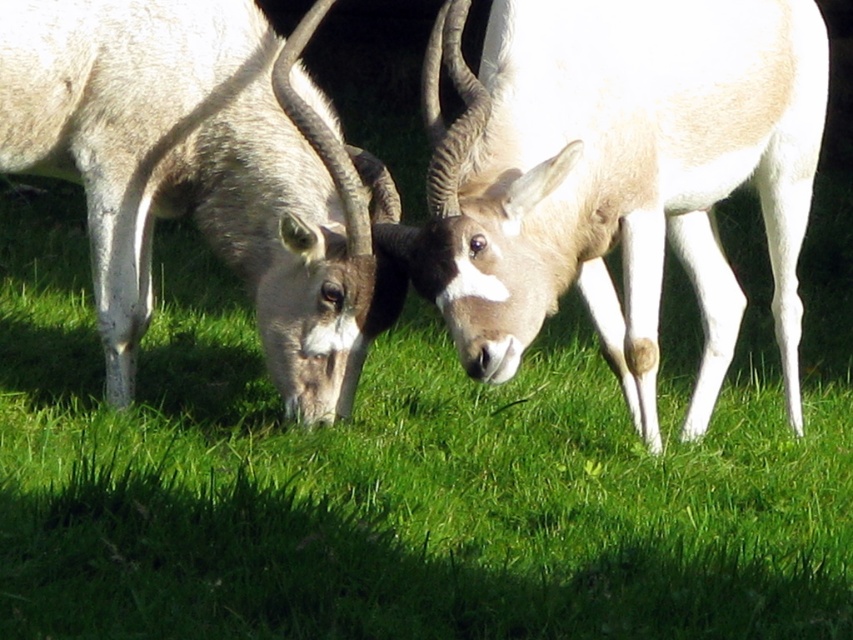
Does green grass at center have a greater width compared to white woolen antelope at center?

Indeed, green grass at center has a greater width compared to white woolen antelope at center.

I want to click on green grass at center, so click(412, 468).

Does green grass at center appear on the right side of white fur antelope at center?

In fact, green grass at center is to the left of white fur antelope at center.

Measure the distance between green grass at center and camera.

A distance of 2.62 meters exists between green grass at center and camera.

Identify the location of green grass at center. The width and height of the screenshot is (853, 640). (412, 468).

Which of these two, white fur antelope at center or white woolen antelope at center, stands shorter?

white woolen antelope at center is shorter.

Can you confirm if white fur antelope at center is smaller than white woolen antelope at center?

Actually, white fur antelope at center might be larger than white woolen antelope at center.

Is point (469, 97) in front of point (119, 342)?

Yes.

This screenshot has width=853, height=640. I want to click on white fur antelope at center, so click(616, 177).